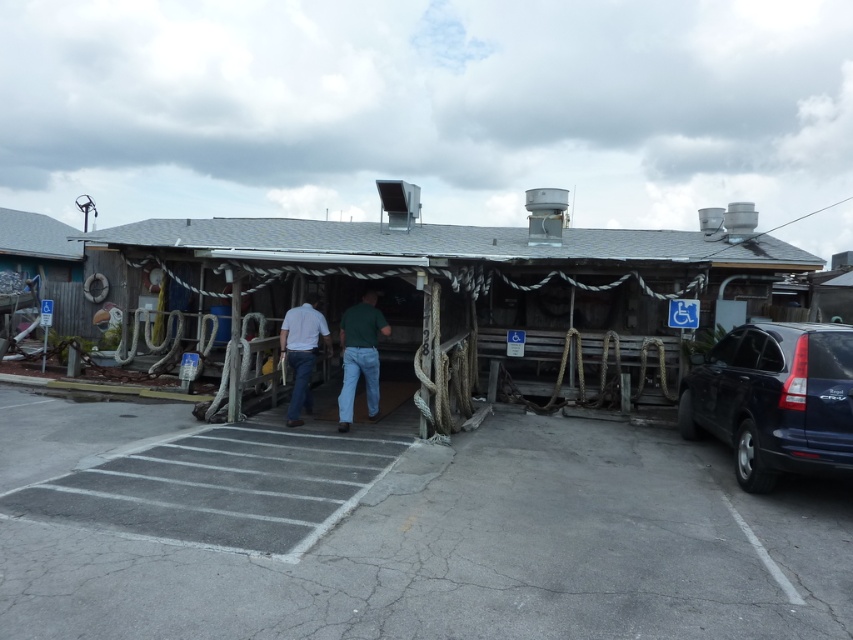
You are standing outside the rustic wooden building and want to place a small potted plant between the two points marked as point (167, 259) and point (289, 420). Which point should the plant be closer to in order to be nearer to the entrance?

The plant should be closer to point (289, 420) because point (167, 259) is further away from the entrance, and placing it near the closer point would position it nearer to the entrance.

You are standing at the entrance of the rustic wooden building and see the gray asphalt parking lot at lower center and the green cotton shirt at center. Which object is positioned to the right of the other?

The gray asphalt parking lot at lower center is to the right of the green cotton shirt at center.